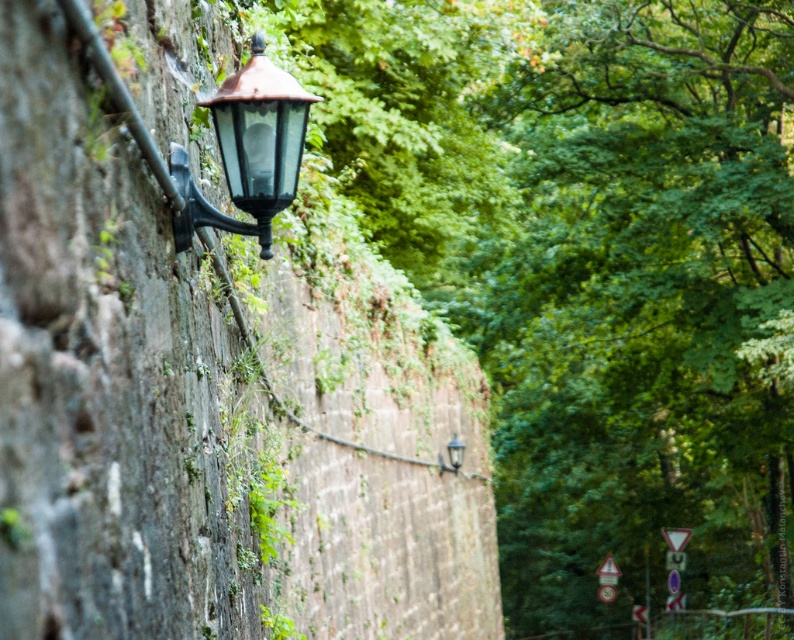
Which is more to the left, green leafy tree at upper left or copper/black glass lamp at upper left?

From the viewer's perspective, copper/black glass lamp at upper left appears more on the left side.

Can you confirm if green leafy tree at upper left is thinner than copper/black glass lamp at upper left?

No.

Between point (648, 422) and point (291, 186), which one is positioned in front?

Point (291, 186) is in front.

In order to click on green leafy tree at upper left in this screenshot , I will do `click(588, 266)`.

Which is in front, point (239, 163) or point (451, 467)?

Point (239, 163)

Who is shorter, copper/black glass lamp at upper left or matte black lamp at upper left?

Standing shorter between the two is matte black lamp at upper left.

Is point (272, 163) positioned in front of point (451, 458)?

Yes.

At what (x,y) coordinates should I click in order to perform the action: click on copper/black glass lamp at upper left. Please return your answer as a coordinate pair (x, y). The height and width of the screenshot is (640, 794). Looking at the image, I should click on click(249, 148).

Is green leafy tree at upper left closer to the viewer compared to matte black lamp at upper left?

Yes, it is.

Identify the location of green leafy tree at upper left. The width and height of the screenshot is (794, 640). (588, 266).

The height and width of the screenshot is (640, 794). What are the coordinates of `green leafy tree at upper left` in the screenshot? It's located at (588, 266).